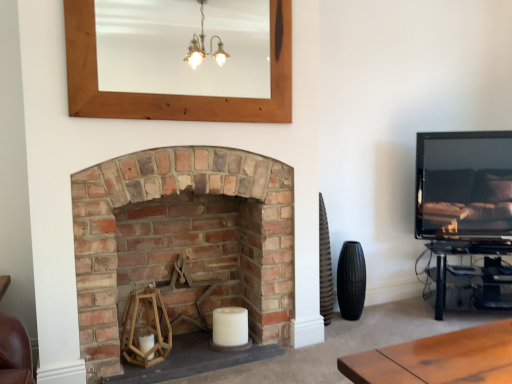
Question: From the image's perspective, is rustic brick fireplace at center located above matte black tv at right?

Choices:
 (A) yes
 (B) no

Answer: (B)

Question: Is rustic brick fireplace at center to the right of matte black tv at right from the viewer's perspective?

Choices:
 (A) no
 (B) yes

Answer: (A)

Question: Is rustic brick fireplace at center oriented towards matte black tv at right?

Choices:
 (A) no
 (B) yes

Answer: (A)

Question: Considering the relative sizes of rustic brick fireplace at center and matte black tv at right in the image provided, is rustic brick fireplace at center bigger than matte black tv at right?

Choices:
 (A) yes
 (B) no

Answer: (A)

Question: Is rustic brick fireplace at center at the left side of matte black tv at right?

Choices:
 (A) no
 (B) yes

Answer: (B)

Question: From the image's perspective, relative to wooden mirror at upper center, is matte black tv at right above or below?

Choices:
 (A) below
 (B) above

Answer: (A)

Question: Relative to wooden mirror at upper center, is matte black tv at right in front or behind?

Choices:
 (A) behind
 (B) front

Answer: (A)

Question: From a real-world perspective, is matte black tv at right positioned above or below wooden mirror at upper center?

Choices:
 (A) below
 (B) above

Answer: (A)

Question: Based on their sizes in the image, would you say matte black tv at right is bigger or smaller than wooden mirror at upper center?

Choices:
 (A) big
 (B) small

Answer: (A)

Question: Considering their positions, is wooden mirror at upper center located in front of or behind rustic brick fireplace at center?

Choices:
 (A) front
 (B) behind

Answer: (A)

Question: Considering the positions of wooden mirror at upper center and rustic brick fireplace at center in the image, is wooden mirror at upper center bigger or smaller than rustic brick fireplace at center?

Choices:
 (A) big
 (B) small

Answer: (B)

Question: Based on their positions, is wooden mirror at upper center located to the left or right of rustic brick fireplace at center?

Choices:
 (A) right
 (B) left

Answer: (A)

Question: Considering the positions of wooden mirror at upper center and rustic brick fireplace at center in the image, is wooden mirror at upper center wider or thinner than rustic brick fireplace at center?

Choices:
 (A) wide
 (B) thin

Answer: (B)

Question: Considering their positions, is rustic brick fireplace at center located in front of or behind matte black tv at right?

Choices:
 (A) behind
 (B) front

Answer: (B)

Question: Do you think rustic brick fireplace at center is within matte black tv at right, or outside of it?

Choices:
 (A) outside
 (B) inside

Answer: (A)